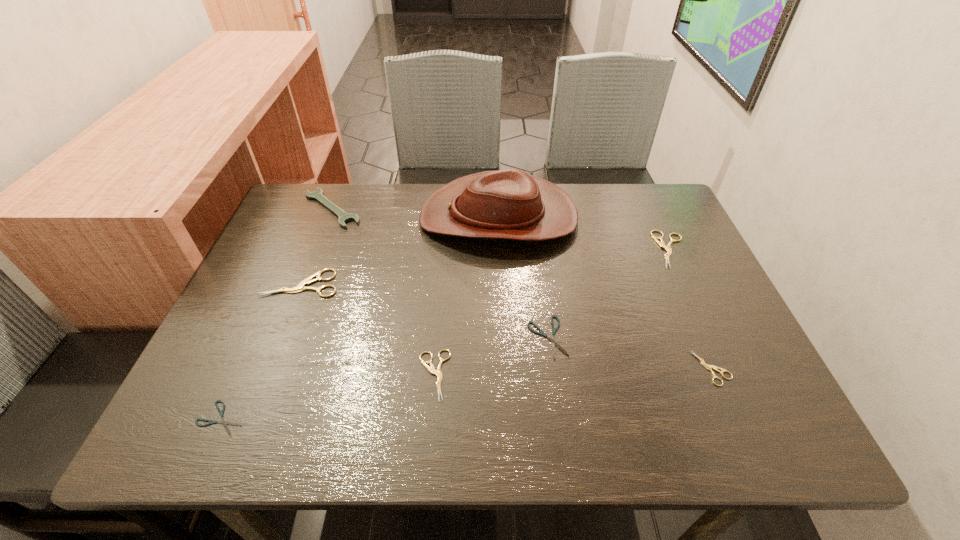
Locate an element on the screen. The image size is (960, 540). the farther black shears is located at coordinates (552, 339).

You are a GUI agent. You are given a task and a screenshot of the screen. Output one action in this format:
    pyautogui.click(x=<x>, y=<y>)
    Task: Click on the bigger black shears
    
    Given the screenshot: What is the action you would take?
    pyautogui.click(x=552, y=339)

Locate an element on the screen. Image resolution: width=960 pixels, height=540 pixels. the smaller black shears is located at coordinates (222, 421).

You are a GUI agent. You are given a task and a screenshot of the screen. Output one action in this format:
    pyautogui.click(x=<x>, y=<y>)
    Task: Click on the nearer black shears
    
    Given the screenshot: What is the action you would take?
    pyautogui.click(x=222, y=421)

The image size is (960, 540). I want to click on free space located 0.130m on the front-facing side of the cowboy hat, so click(373, 217).

Identify the location of free space located 0.310m on the front-facing side of the cowboy hat. This screenshot has width=960, height=540. (310, 217).

Identify the location of free space located on the front-facing side of the cowboy hat. The width and height of the screenshot is (960, 540). tap(367, 217).

Identify the location of vacant area located on the right of the seventh shortest object. This screenshot has width=960, height=540. (454, 208).

The width and height of the screenshot is (960, 540). Identify the location of vacant region located 0.120m on the front of the third tallest object. (278, 340).

Find the location of a particular element. Image resolution: width=960 pixels, height=540 pixels. vacant space situated 0.090m on the front of the farthest beige shears is located at coordinates (693, 296).